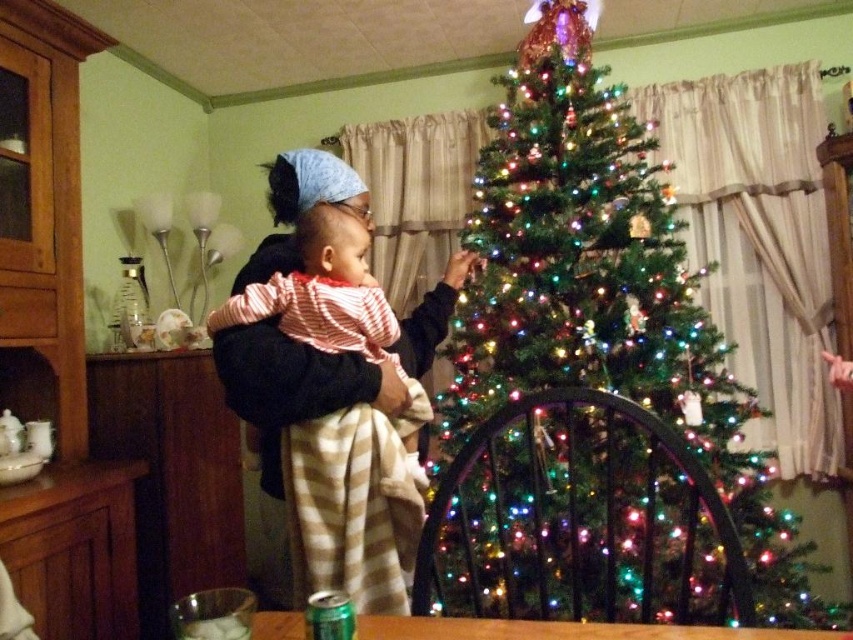
You are a parent holding a baby wrapped in the striped fabric blanket at center. You want to place the baby on the floor near the green matte christmas tree at center. Is there enough space between the two objects for the baby to be placed safely?

The green matte christmas tree at center is 17.14 inches away from the striped fabric blanket at center. Since the distance is sufficient, the baby can be safely placed on the floor between them without any obstruction.

You are a photographer standing in front of the green matte christmas tree at center. You want to take a photo of the tree from a distance of exactly 1.04 meters. Is your current position suitable for taking the photo?

Yes, the green matte christmas tree at center and the camera are 1.04 meters apart, so your current position is exactly 1.04 meters away from the tree, making it suitable for taking the photo.

You are a parent holding a baby wrapped in the striped fabric blanket at center. You want to place the baby on the floor near the green matte christmas tree at center so they can play safely. Considering their height difference, will the baby be able to see the top of the tree while sitting on the blanket?

The green matte christmas tree at center is taller than the striped fabric blanket at center. Since the baby is sitting on the blanket, they might still be able to see the top of the tree depending on their eye level, but the tree is significantly taller so part of it would be visible.